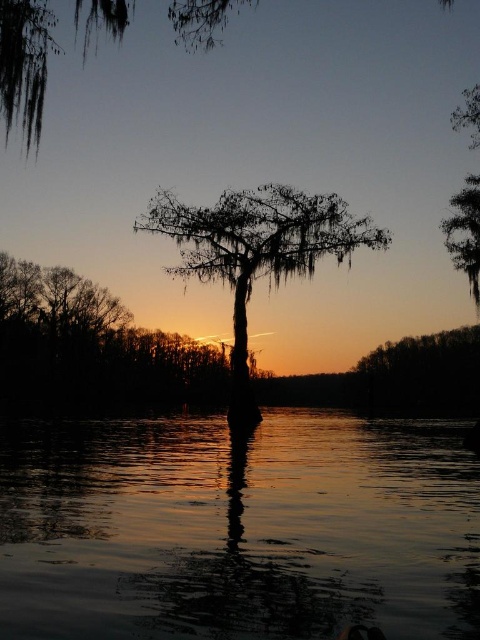
Is silhouette mossy cypress tree at center shorter than green mossy branch at upper left?

Correct, silhouette mossy cypress tree at center is not as tall as green mossy branch at upper left.

Measure the distance between silhouette mossy cypress tree at center and green mossy branch at upper left.

silhouette mossy cypress tree at center and green mossy branch at upper left are 14.03 meters apart.

This screenshot has width=480, height=640. Describe the element at coordinates (255, 252) in the screenshot. I see `silhouette mossy cypress tree at center` at that location.

In order to click on silhouette mossy cypress tree at center in this screenshot , I will do `click(255, 252)`.

Who is shorter, glossy reflective water at center or silhouette mossy cypress tree at center?

With less height is glossy reflective water at center.

From the picture: Who is more forward, (427,488) or (203,212)?

Point (427,488)

The width and height of the screenshot is (480, 640). In order to click on glossy reflective water at center in this screenshot , I will do `click(238, 529)`.

Does point (271, 556) come farther from viewer compared to point (479, 248)?

No, it is not.

Where is `glossy reflective water at center`? This screenshot has width=480, height=640. glossy reflective water at center is located at coordinates (238, 529).

This screenshot has height=640, width=480. I want to click on glossy reflective water at center, so click(x=238, y=529).